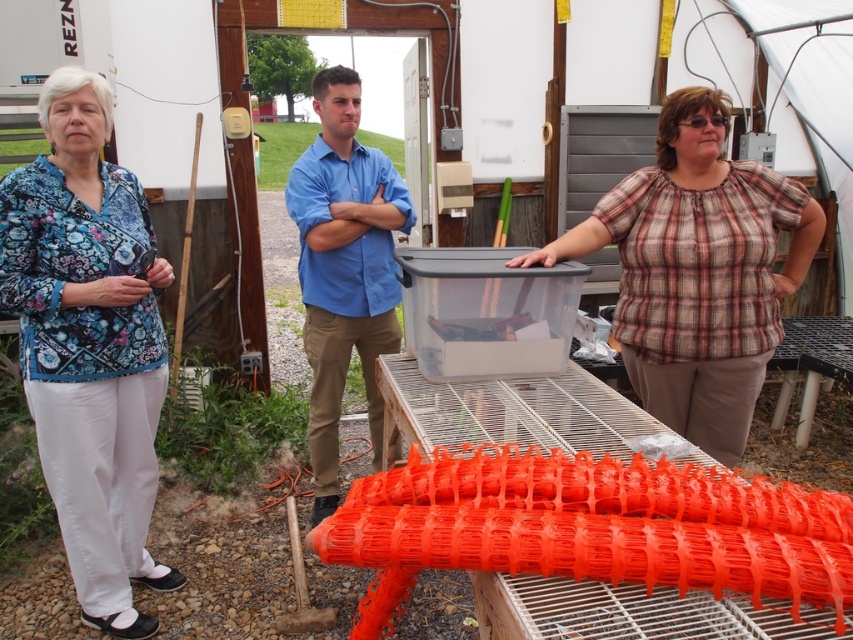
Question: Is floral fabric blouse at left closer to camera compared to blue cotton shirt at center?

Choices:
 (A) no
 (B) yes

Answer: (B)

Question: Which point is farther to the camera?

Choices:
 (A) (312, 369)
 (B) (630, 184)
 (C) (68, 337)

Answer: (A)

Question: Can you confirm if floral fabric blouse at left is bigger than blue cotton shirt at center?

Choices:
 (A) yes
 (B) no

Answer: (B)

Question: Which of the following is the farthest from the observer?

Choices:
 (A) (366, 250)
 (B) (129, 394)
 (C) (724, 230)

Answer: (A)

Question: Which object is farther from the camera taking this photo?

Choices:
 (A) floral fabric blouse at left
 (B) plaid cotton shirt at center
 (C) blue cotton shirt at center

Answer: (C)

Question: Where is floral fabric blouse at left located in relation to plaid cotton shirt at center in the image?

Choices:
 (A) left
 (B) right

Answer: (A)